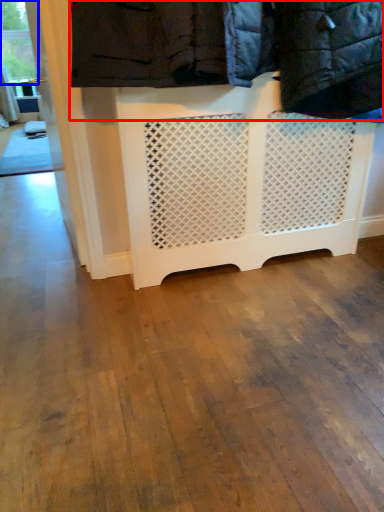
Question: Which point is closer to the camera, laundry (highlighted by a red box) or window frame (highlighted by a blue box)?

Choices:
 (A) laundry
 (B) window frame

Answer: (A)